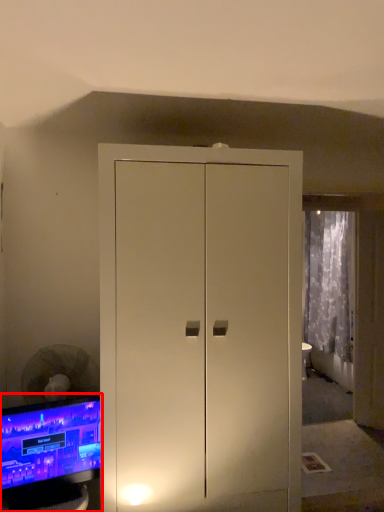
Question: From the image's perspective, where is computer monitor (annotated by the red box) located in relation to curtain in the image?

Choices:
 (A) above
 (B) below

Answer: (B)